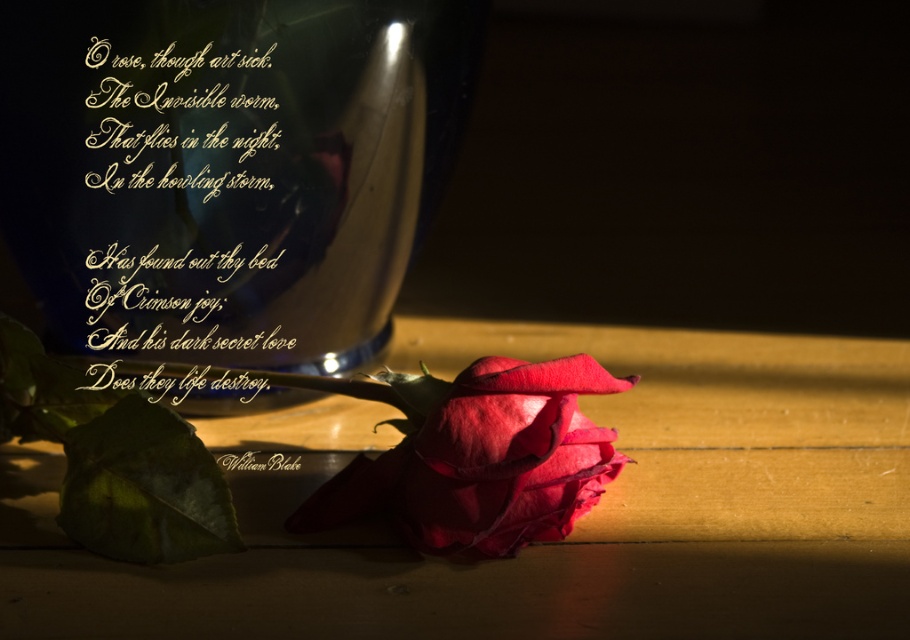
Question: Which object is positioned closest to the glossy glass vase at upper center?

Choices:
 (A) wooden table at lower center
 (B) gold calligraphy at upper left

Answer: (B)

Question: Which point is farther to the camera?

Choices:
 (A) wooden table at lower center
 (B) gold calligraphy at upper left

Answer: (B)

Question: Does glossy glass vase at upper center appear over crimson velvet rose at center?

Choices:
 (A) no
 (B) yes

Answer: (B)

Question: Which point appears farthest from the camera in this image?

Choices:
 (A) (443, 404)
 (B) (662, 624)
 (C) (96, 296)

Answer: (C)

Question: Is gold calligraphy at upper left thinner than crimson velvet rose at center?

Choices:
 (A) no
 (B) yes

Answer: (A)

Question: Does gold calligraphy at upper left lie in front of crimson velvet rose at center?

Choices:
 (A) yes
 (B) no

Answer: (B)